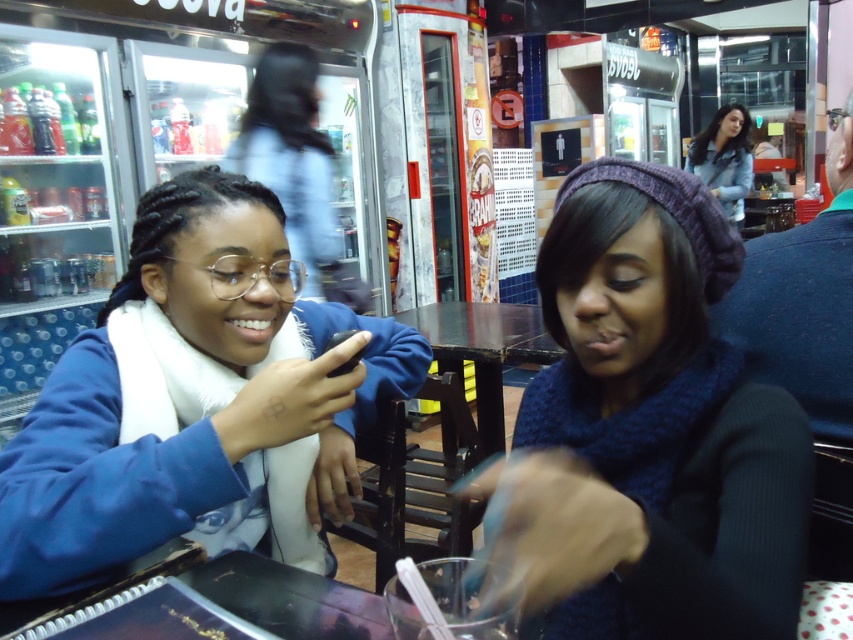
You are standing at the entrance of the dining area and want to locate the knitted purple beanie at upper right. According to the coordinates provided, where should you look relative to the center of the image?

The knitted purple beanie at upper right is located at coordinates point 0.669 on the x axis and 0.767 on the y axis, which means it is positioned to the right and above the center of the image.

You are a photographer taking a picture of the knitted purple beanie at upper right and the blue fleece jacket at left. Which object will appear closer to the camera in the final photo?

The knitted purple beanie at upper right will appear closer to the camera in the final photo because it is positioned in front of the blue fleece jacket at left.